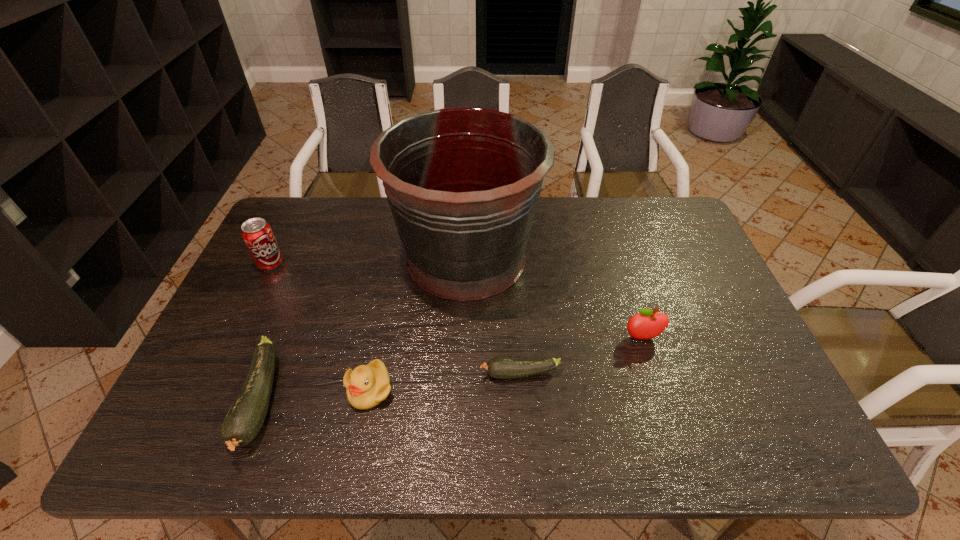
Identify the location of object present at the near left corner. This screenshot has height=540, width=960. (245, 418).

Where is `free region at the far edge of the desktop`? free region at the far edge of the desktop is located at coordinates (567, 211).

The height and width of the screenshot is (540, 960). In the image, there is a desktop. What are the coordinates of `vacant space at the near edge` in the screenshot? It's located at (670, 395).

Locate an element on the screen. The image size is (960, 540). vacant space at the left edge of the desktop is located at coordinates (210, 371).

The image size is (960, 540). In order to click on vacant space at the far left corner of the desktop in this screenshot , I will do `click(313, 205)`.

Image resolution: width=960 pixels, height=540 pixels. Identify the location of vacant space at the near left corner. (198, 395).

The width and height of the screenshot is (960, 540). Identify the location of free space that is in between the shortest object and the duckling. (444, 381).

The width and height of the screenshot is (960, 540). What are the coordinates of `free space that is in between the tallest object and the second tallest object` in the screenshot? It's located at (369, 261).

You are a GUI agent. You are given a task and a screenshot of the screen. Output one action in this format:
    pyautogui.click(x=<x>, y=<y>)
    Task: Click on the vacant point located between the taller zucchini and the second tallest object
    
    Given the screenshot: What is the action you would take?
    pyautogui.click(x=266, y=333)

Identify the location of vacant space in between the fifth shortest object and the shorter zucchini. The height and width of the screenshot is (540, 960). (396, 319).